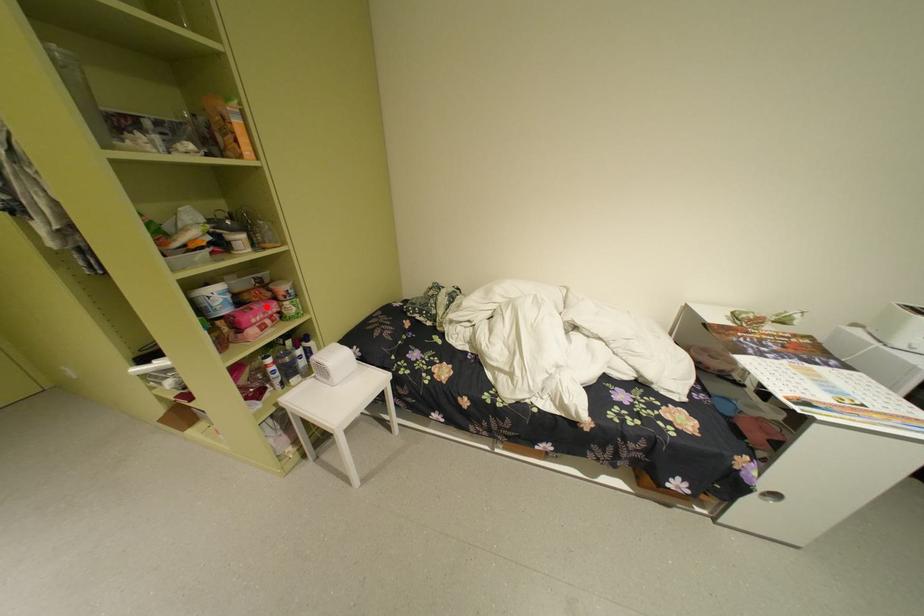
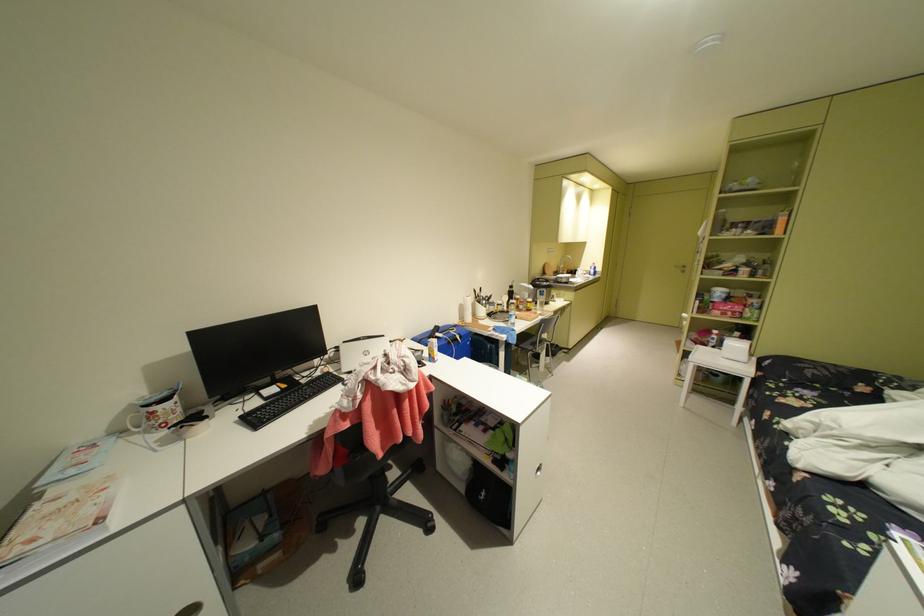
Find the pixel in the second image that matches the highlighted location in the first image.

(740, 304)